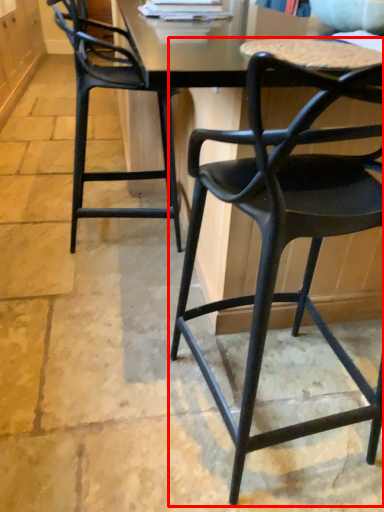
Question: Observing the image, what is the correct spatial positioning of chair (annotated by the red box) in reference to chair?

Choices:
 (A) right
 (B) left

Answer: (A)